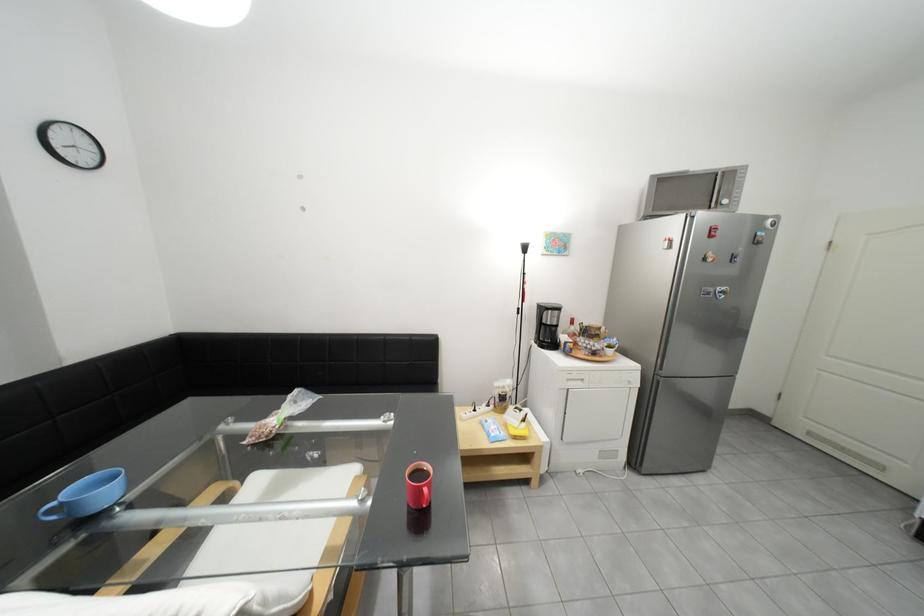
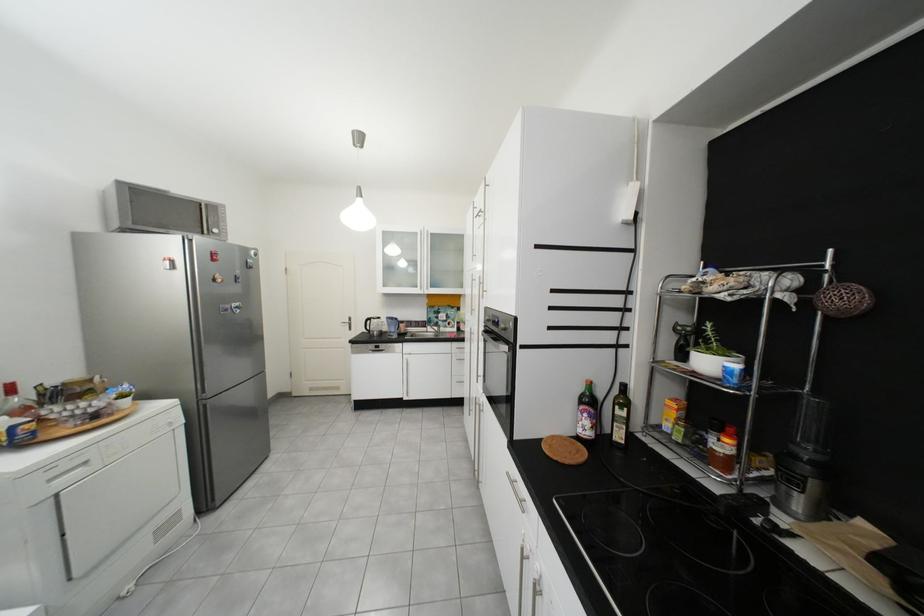
In the second image, find the point that corresponds to (648,464) in the first image.

(217, 505)